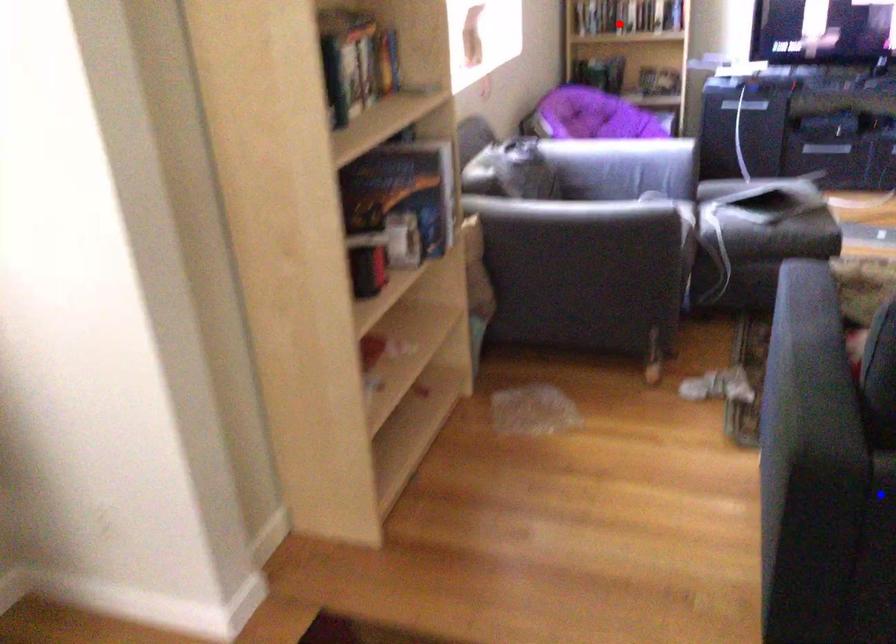
Question: Which of the two points in the image is closer to the camera?

Choices:
 (A) Blue point is closer.
 (B) Red point is closer.

Answer: (A)